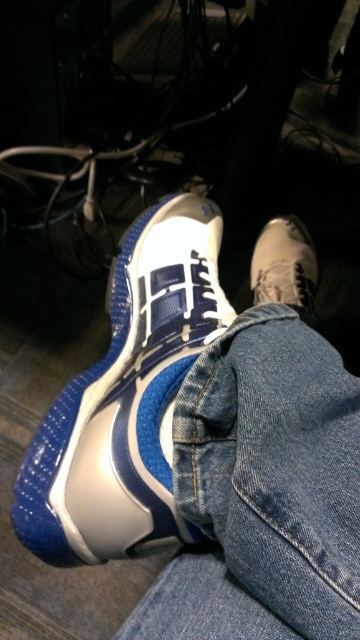
Question: Which object is closer to the camera taking this photo?

Choices:
 (A) blue rubber sneaker at lower left
 (B) leather sneaker at lower right
 (C) denim at lower left

Answer: (C)

Question: Among these objects, which one is farthest from the camera?

Choices:
 (A) blue rubber sneaker at lower left
 (B) leather sneaker at lower right

Answer: (B)

Question: Is denim at lower left thinner than leather sneaker at lower right?

Choices:
 (A) no
 (B) yes

Answer: (A)

Question: Which object is farther from the camera taking this photo?

Choices:
 (A) denim at lower left
 (B) leather sneaker at lower right
 (C) blue rubber sneaker at lower left

Answer: (B)

Question: Can you confirm if blue rubber sneaker at lower left is smaller than leather sneaker at lower right?

Choices:
 (A) no
 (B) yes

Answer: (A)

Question: Is blue rubber sneaker at lower left in front of leather sneaker at lower right?

Choices:
 (A) no
 (B) yes

Answer: (B)